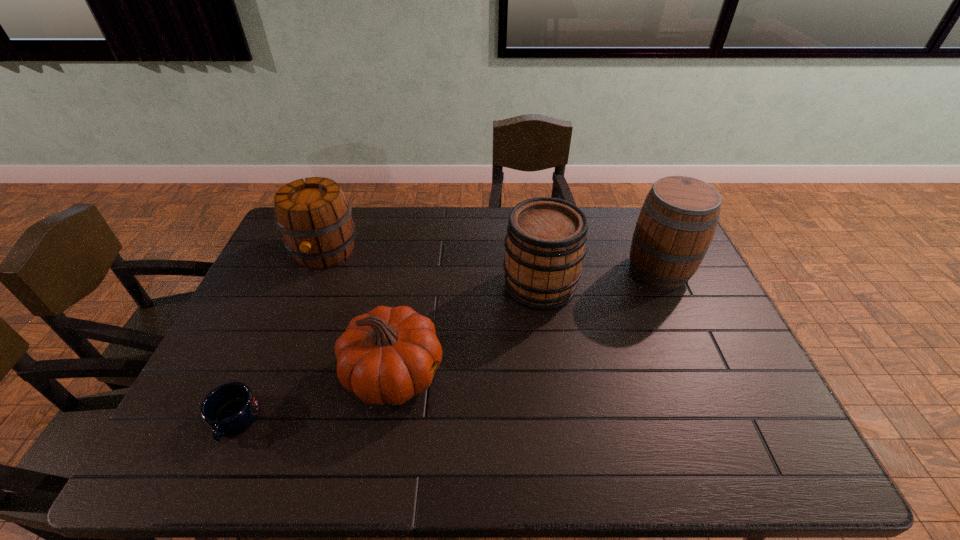
Where is `unoccupied position between the rightmost object and the fourth object from left to right`? This screenshot has width=960, height=540. unoccupied position between the rightmost object and the fourth object from left to right is located at coordinates (600, 278).

Identify which object is the second closest to the leftmost cider. Please provide its 2D coordinates. Your answer should be formatted as a tuple, i.e. [(x, y)], where the tuple contains the x and y coordinates of a point satisfying the conditions above.

[(229, 409)]

Identify which object is located as the second nearest to the second object from right to left. Please provide its 2D coordinates. Your answer should be formatted as a tuple, i.e. [(x, y)], where the tuple contains the x and y coordinates of a point satisfying the conditions above.

[(385, 356)]

At what (x,y) coordinates should I click in order to perform the action: click on cider that is the third closest to the third object from right to left. Please return your answer as a coordinate pair (x, y). Looking at the image, I should click on coord(677,222).

The width and height of the screenshot is (960, 540). I want to click on cider that is the second closest to the mug, so click(545, 243).

This screenshot has height=540, width=960. Find the location of `vacant space that satisfies the following two spatial constraints: 1. on the back side of the second object from right to left; 2. on the right side of the rightmost object`. vacant space that satisfies the following two spatial constraints: 1. on the back side of the second object from right to left; 2. on the right side of the rightmost object is located at coordinates (538, 270).

Where is `free location that satisfies the following two spatial constraints: 1. on the side of the second cider from left to right where the spigot is located; 2. on the right side of the leftmost cider`? The width and height of the screenshot is (960, 540). free location that satisfies the following two spatial constraints: 1. on the side of the second cider from left to right where the spigot is located; 2. on the right side of the leftmost cider is located at coordinates (310, 286).

Find the location of a particular element. This screenshot has height=540, width=960. vacant space that satisfies the following two spatial constraints: 1. on the front side of the fourth object from left to right; 2. on the face of the third object from right to left is located at coordinates (553, 374).

Locate an element on the screen. This screenshot has width=960, height=540. free spot that satisfies the following two spatial constraints: 1. on the front side of the second cider from left to right; 2. on the face of the pumpkin is located at coordinates (553, 374).

Locate an element on the screen. vacant space that satisfies the following two spatial constraints: 1. on the side of the rightmost cider where the spigot is located; 2. on the right side of the leftmost cider is located at coordinates (317, 270).